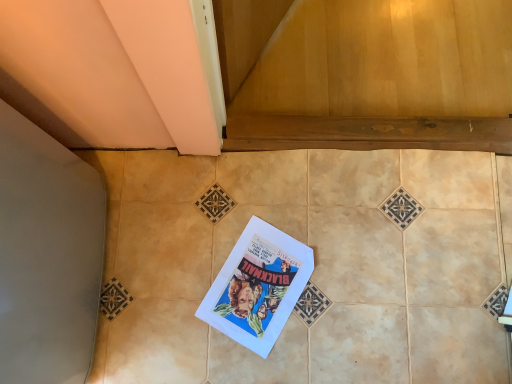
What do you see at coordinates (315, 266) in the screenshot? I see `beige ceramic tile at center` at bounding box center [315, 266].

Find the location of a particular element. beige ceramic tile at center is located at coordinates (315, 266).

Describe the element at coordinates (258, 286) in the screenshot. The height and width of the screenshot is (384, 512). I see `white paper comic book at center` at that location.

Locate an element on the screen. The image size is (512, 384). white paper comic book at center is located at coordinates coord(258,286).

This screenshot has width=512, height=384. In order to click on beige ceramic tile at center in this screenshot , I will do `click(315, 266)`.

In the scene shown: Which is more to the right, beige ceramic tile at center or white paper comic book at center?

Positioned to the right is beige ceramic tile at center.

Does beige ceramic tile at center lie in front of white paper comic book at center?

Yes.

Considering the points (446, 310) and (240, 247), which point is behind, point (446, 310) or point (240, 247)?

The point (240, 247) is more distant.

From the image's perspective, is beige ceramic tile at center positioned above or below white paper comic book at center?

Clearly, from the image's perspective, beige ceramic tile at center is above white paper comic book at center.

From a real-world perspective, does beige ceramic tile at center sit lower than white paper comic book at center?

No, from a real-world perspective, beige ceramic tile at center is not beneath white paper comic book at center.

Which object is thinner, beige ceramic tile at center or white paper comic book at center?

With smaller width is white paper comic book at center.

Is beige ceramic tile at center taller than white paper comic book at center?

Correct, beige ceramic tile at center is much taller as white paper comic book at center.

Looking at the image, does beige ceramic tile at center seem bigger or smaller compared to white paper comic book at center?

Clearly, beige ceramic tile at center is larger in size than white paper comic book at center.

Is beige ceramic tile at center situated inside white paper comic book at center or outside?

beige ceramic tile at center is located beyond the bounds of white paper comic book at center.

Is beige ceramic tile at center beside white paper comic book at center?

beige ceramic tile at center and white paper comic book at center are not in contact.

Could you tell me if beige ceramic tile at center is facing white paper comic book at center?

Yes, beige ceramic tile at center is facing white paper comic book at center.

Can you tell me how much beige ceramic tile at center and white paper comic book at center differ in facing direction?

beige ceramic tile at center and white paper comic book at center are facing 32.5 degrees away from each other.

How far apart are beige ceramic tile at center and white paper comic book at center?

beige ceramic tile at center is 6.29 inches away from white paper comic book at center.

Locate an element on the screen. This screenshot has width=512, height=384. comic book below the beige ceramic tile at center (from a real-world perspective) is located at coordinates (258, 286).

Between white paper comic book at center and beige ceramic tile at center, which one appears on the left side from the viewer's perspective?

Positioned to the left is white paper comic book at center.

Which object is further away from the camera, white paper comic book at center or beige ceramic tile at center?

white paper comic book at center is further from the camera.

Does point (273, 252) lie in front of point (458, 227)?

Yes.

From the image's perspective, is white paper comic book at center positioned above or below beige ceramic tile at center?

From the image's perspective, white paper comic book at center appears below beige ceramic tile at center.

From a real-world perspective, which object rests below the other?

white paper comic book at center, from a real-world perspective.

Can you confirm if white paper comic book at center is wider than beige ceramic tile at center?

In fact, white paper comic book at center might be narrower than beige ceramic tile at center.

Does white paper comic book at center have a greater height compared to beige ceramic tile at center?

In fact, white paper comic book at center may be shorter than beige ceramic tile at center.

Considering the relative sizes of white paper comic book at center and beige ceramic tile at center in the image provided, is white paper comic book at center smaller than beige ceramic tile at center?

Indeed, white paper comic book at center has a smaller size compared to beige ceramic tile at center.

Is white paper comic book at center located outside beige ceramic tile at center?

Actually, white paper comic book at center is within beige ceramic tile at center.

Is there a large distance between white paper comic book at center and beige ceramic tile at center?

No, white paper comic book at center is not far from beige ceramic tile at center.

Does white paper comic book at center turn towards beige ceramic tile at center?

Yes, white paper comic book at center is facing beige ceramic tile at center.

The width and height of the screenshot is (512, 384). Find the location of `comic book behind the beige ceramic tile at center`. comic book behind the beige ceramic tile at center is located at coordinates (258, 286).

The height and width of the screenshot is (384, 512). What are the coordinates of `comic book to the left of beige ceramic tile at center` in the screenshot? It's located at (258, 286).

Locate an element on the screen. The width and height of the screenshot is (512, 384). comic book below the beige ceramic tile at center (from a real-world perspective) is located at coordinates (258, 286).